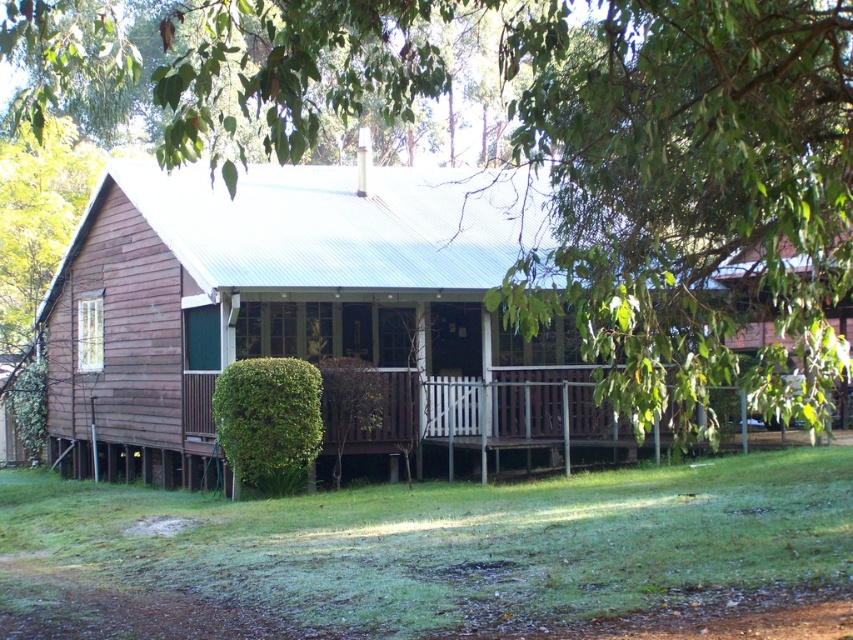
Question: From the image, what is the correct spatial relationship of green leafy tree at center in relation to green grass at lower center?

Choices:
 (A) below
 (B) above

Answer: (B)

Question: Can you confirm if green leafy tree at center is smaller than green grass at lower center?

Choices:
 (A) yes
 (B) no

Answer: (B)

Question: Which object appears farthest from the camera in this image?

Choices:
 (A) green leafy tree at center
 (B) green grass at lower center

Answer: (B)

Question: Among these points, which one is nearest to the camera?

Choices:
 (A) (749, 230)
 (B) (578, 595)

Answer: (A)

Question: In this image, where is green leafy tree at center located relative to green grass at lower center?

Choices:
 (A) above
 (B) below

Answer: (A)